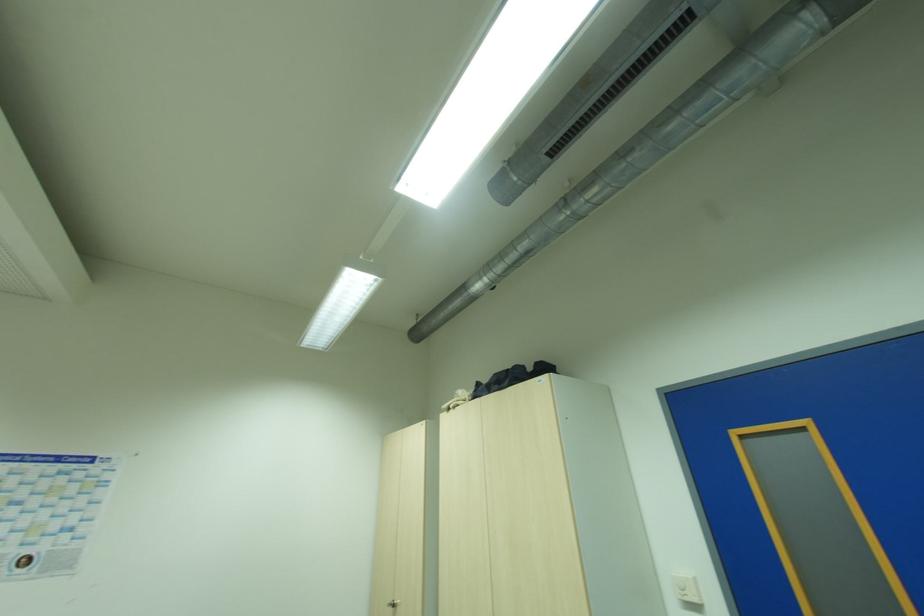
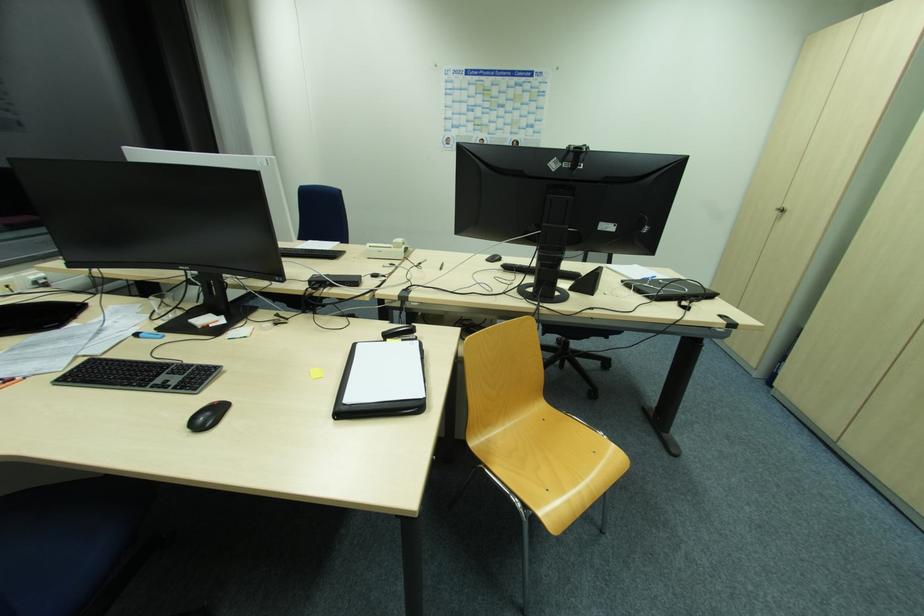
How did the camera likely rotate?

The camera rotated toward left-down.